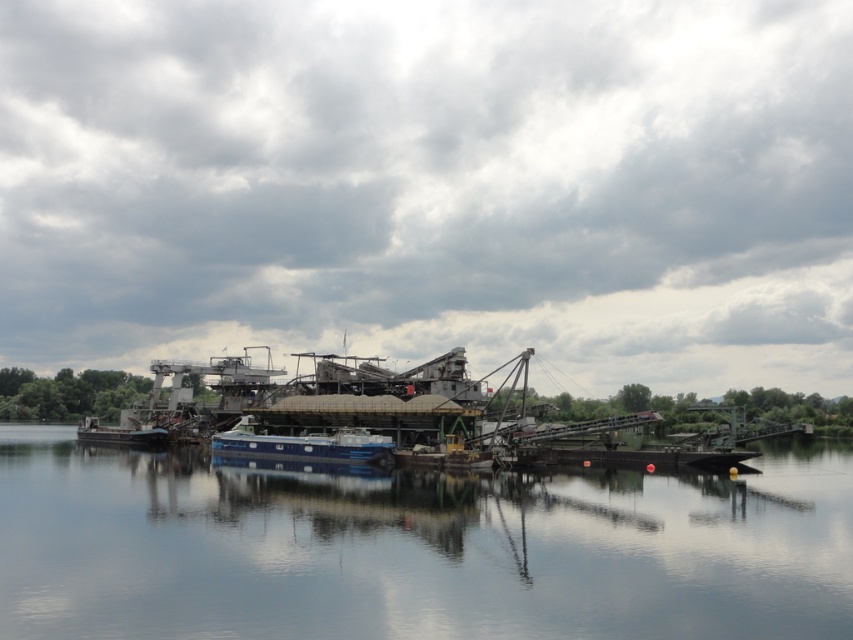
Question: Which of the following is the closest to the observer?

Choices:
 (A) blue metallic barge at center
 (B) smooth blue water at center
 (C) blue matte boat at center

Answer: (B)

Question: Which point is farther to the camera?

Choices:
 (A) blue metallic barge at center
 (B) smooth blue water at center

Answer: (A)

Question: Is smooth blue water at center to the right of blue matte boat at center from the viewer's perspective?

Choices:
 (A) no
 (B) yes

Answer: (B)

Question: Where is blue matte boat at center located in relation to blue metallic barge at center in the image?

Choices:
 (A) above
 (B) below

Answer: (A)

Question: Does blue matte boat at center have a lesser width compared to blue metallic barge at center?

Choices:
 (A) yes
 (B) no

Answer: (B)

Question: Which of the following is the closest to the observer?

Choices:
 (A) blue matte boat at center
 (B) smooth blue water at center

Answer: (B)